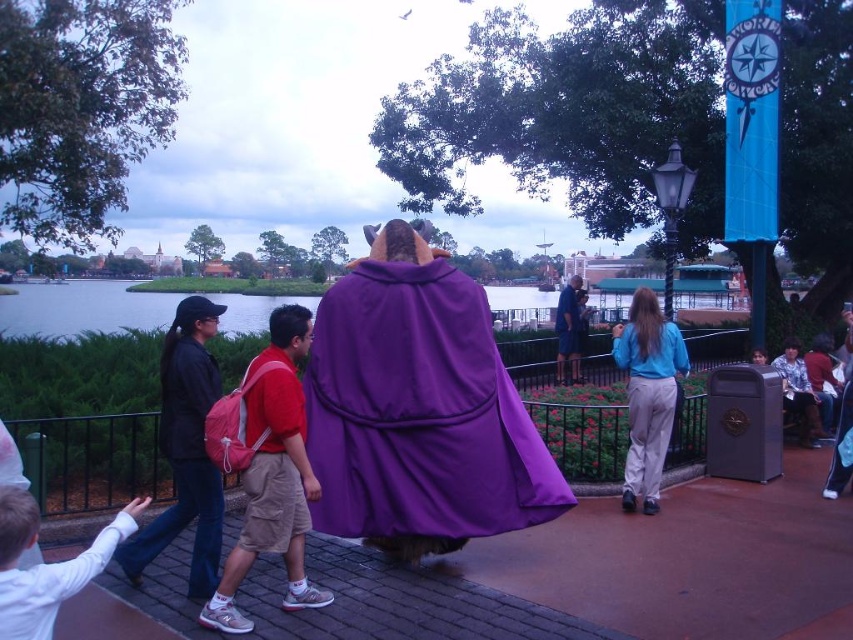
Can you confirm if red backpack at center is shorter than black fabric backpack at left?

No.

Who is more forward, (309, 499) or (202, 512)?

Point (309, 499)

Locate an element on the screen. Image resolution: width=853 pixels, height=640 pixels. red backpack at center is located at coordinates [267, 468].

Can you confirm if purple fleece cape at center is positioned below black fabric backpack at left?

Incorrect, purple fleece cape at center is not positioned below black fabric backpack at left.

Is purple fleece cape at center above black fabric backpack at left?

Yes.

Describe the element at coordinates (418, 410) in the screenshot. I see `purple fleece cape at center` at that location.

I want to click on purple fleece cape at center, so click(x=418, y=410).

Between point (270, 525) and point (573, 336), which one is positioned in front?

Point (270, 525) is in front.

Is point (294, 428) more distant than point (572, 316)?

No, it is not.

You are a GUI agent. You are given a task and a screenshot of the screen. Output one action in this format:
    pyautogui.click(x=<x>, y=<y>)
    Task: Click on the red backpack at center
    
    Given the screenshot: What is the action you would take?
    pyautogui.click(x=267, y=468)